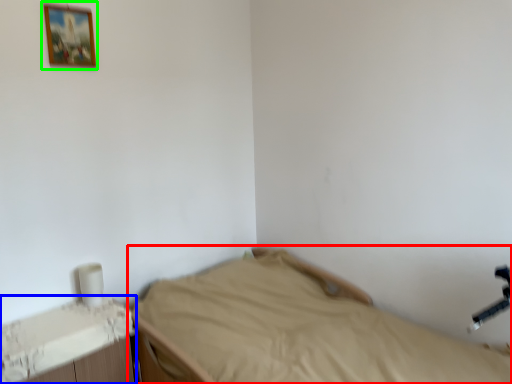
Question: Considering the real-world distances, which object is farthest from bed (highlighted by a red box)? changing table (highlighted by a blue box) or picture frame (highlighted by a green box)?

Choices:
 (A) changing table
 (B) picture frame

Answer: (B)